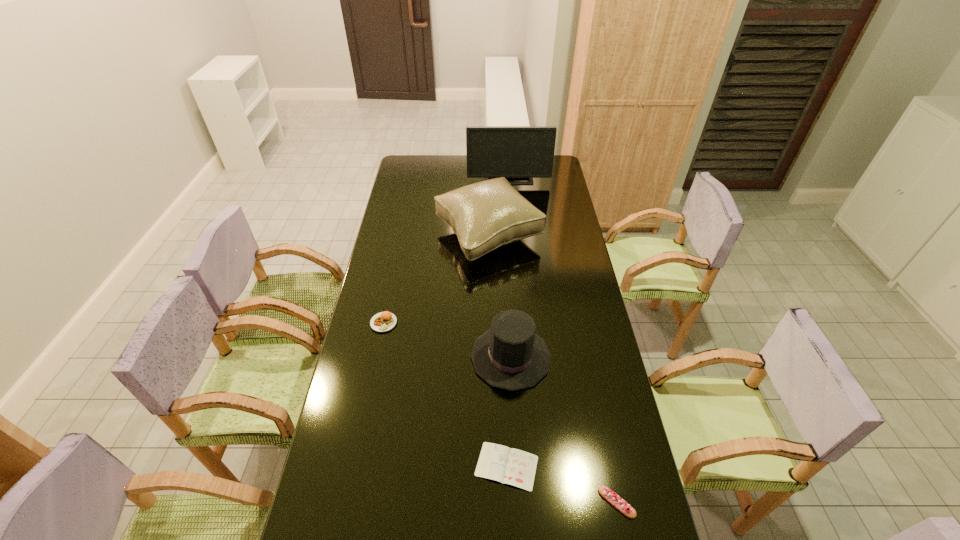
Identify the location of vacant space that's between the fifth nearest object and the dress hat. The height and width of the screenshot is (540, 960). (499, 296).

Where is `free point between the third tallest object and the cushion`? The image size is (960, 540). free point between the third tallest object and the cushion is located at coordinates (499, 296).

Locate an element on the screen. This screenshot has width=960, height=540. free space that is in between the dress hat and the fourth tallest object is located at coordinates (447, 340).

The width and height of the screenshot is (960, 540). Identify the location of vacant point located between the third tallest object and the cushion. (499, 296).

Point out which object is positioned as the fifth nearest to the patty. Please provide its 2D coordinates. Your answer should be formatted as a tuple, i.e. [(x, y)], where the tuple contains the x and y coordinates of a point satisfying the conditions above.

[(514, 152)]

Identify which object is the second closest to the dress hat. Please provide its 2D coordinates. Your answer should be formatted as a tuple, i.e. [(x, y)], where the tuple contains the x and y coordinates of a point satisfying the conditions above.

[(382, 322)]

The height and width of the screenshot is (540, 960). I want to click on blank space that satisfies the following two spatial constraints: 1. on the front of the second shortest object with the decoration; 2. on the right side of the fourth shortest object, so click(x=519, y=502).

Image resolution: width=960 pixels, height=540 pixels. Find the location of `vacant region that satisfies the following two spatial constraints: 1. on the screen side of the second shortest object; 2. on the right side of the computer monitor`. vacant region that satisfies the following two spatial constraints: 1. on the screen side of the second shortest object; 2. on the right side of the computer monitor is located at coordinates (537, 502).

Identify the location of free space that satisfies the following two spatial constraints: 1. on the screen side of the computer monitor; 2. on the left side of the eclair. (537, 502).

Where is `vacant area that satisfies the following two spatial constraints: 1. on the front side of the eclair; 2. on the left side of the fourth tallest object`? vacant area that satisfies the following two spatial constraints: 1. on the front side of the eclair; 2. on the left side of the fourth tallest object is located at coordinates (348, 502).